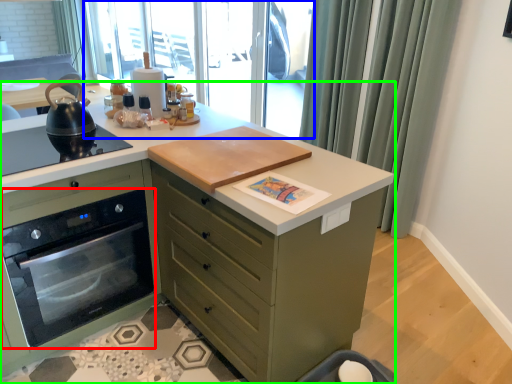
Question: Which is nearer to the home appliance (highlighted by a red box)? window screen (highlighted by a blue box) or countertop (highlighted by a green box).

Choices:
 (A) window screen
 (B) countertop

Answer: (B)